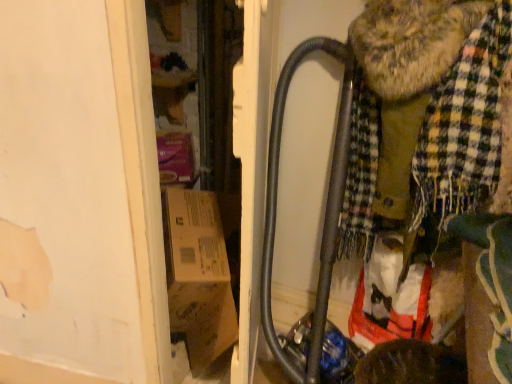
Identify the location of metallic gray baby carriage at center-right. (416, 147).

What do you see at coordinates (416, 147) in the screenshot?
I see `metallic gray baby carriage at center-right` at bounding box center [416, 147].

Based on the photo, what is the approximate height of metallic gray baby carriage at center-right?

metallic gray baby carriage at center-right is 29.77 inches tall.

This screenshot has height=384, width=512. What are the coordinates of `plaid fabric scarf at right` in the screenshot? It's located at (428, 118).

What do you see at coordinates (428, 118) in the screenshot? Image resolution: width=512 pixels, height=384 pixels. I see `plaid fabric scarf at right` at bounding box center [428, 118].

This screenshot has height=384, width=512. I want to click on metallic gray baby carriage at center-right, so click(416, 147).

Which is more to the left, metallic gray baby carriage at center-right or plaid fabric scarf at right?

Positioned to the left is plaid fabric scarf at right.

Is metallic gray baby carriage at center-right positioned in front of plaid fabric scarf at right?

That is False.

Does point (388, 78) come farther from viewer compared to point (352, 164)?

No.

Consider the image. From the image's perspective, between metallic gray baby carriage at center-right and plaid fabric scarf at right, who is located below?

plaid fabric scarf at right, from the image's perspective.

From a real-world perspective, between metallic gray baby carriage at center-right and plaid fabric scarf at right, who is vertically lower?

plaid fabric scarf at right, from a real-world perspective.

In terms of width, does metallic gray baby carriage at center-right look wider or thinner when compared to plaid fabric scarf at right?

In the image, metallic gray baby carriage at center-right appears to be wider than plaid fabric scarf at right.

Considering the relative sizes of metallic gray baby carriage at center-right and plaid fabric scarf at right in the image provided, is metallic gray baby carriage at center-right shorter than plaid fabric scarf at right?

Correct, metallic gray baby carriage at center-right is not as tall as plaid fabric scarf at right.

Is metallic gray baby carriage at center-right smaller than plaid fabric scarf at right?

Yes, metallic gray baby carriage at center-right is smaller than plaid fabric scarf at right.

Which is correct: metallic gray baby carriage at center-right is inside plaid fabric scarf at right, or outside of it?

metallic gray baby carriage at center-right can be found inside plaid fabric scarf at right.

Is metallic gray baby carriage at center-right next to plaid fabric scarf at right and touching it?

Yes, metallic gray baby carriage at center-right and plaid fabric scarf at right clearly make contact.

Is metallic gray baby carriage at center-right oriented towards plaid fabric scarf at right?

Yes, metallic gray baby carriage at center-right is turned towards plaid fabric scarf at right.

Consider the image. How many degrees apart are the facing directions of metallic gray baby carriage at center-right and plaid fabric scarf at right?

89.6 degrees separate the facing orientations of metallic gray baby carriage at center-right and plaid fabric scarf at right.

How distant is metallic gray baby carriage at center-right from plaid fabric scarf at right?

They are 2.00 inches apart.

Where is `scarf on the left of the metallic gray baby carriage at center-right`? The image size is (512, 384). scarf on the left of the metallic gray baby carriage at center-right is located at coordinates (428, 118).

Which object is positioned more to the left, plaid fabric scarf at right or metallic gray baby carriage at center-right?

plaid fabric scarf at right is more to the left.

Considering their positions, is plaid fabric scarf at right located in front of or behind metallic gray baby carriage at center-right?

plaid fabric scarf at right is in front of metallic gray baby carriage at center-right.

Considering the positions of points (499, 43) and (306, 369), is point (499, 43) closer to camera compared to point (306, 369)?

Yes, it is in front of point (306, 369).

From the image's perspective, is plaid fabric scarf at right positioned above or below metallic gray baby carriage at center-right?

Clearly, from the image's perspective, plaid fabric scarf at right is below metallic gray baby carriage at center-right.

From a real-world perspective, which is physically below, plaid fabric scarf at right or metallic gray baby carriage at center-right?

In real-world perspective, plaid fabric scarf at right is lower.

Can you confirm if plaid fabric scarf at right is thinner than metallic gray baby carriage at center-right?

Yes.

Can you confirm if plaid fabric scarf at right is shorter than metallic gray baby carriage at center-right?

In fact, plaid fabric scarf at right may be taller than metallic gray baby carriage at center-right.

Is plaid fabric scarf at right bigger or smaller than metallic gray baby carriage at center-right?

Considering their sizes, plaid fabric scarf at right takes up more space than metallic gray baby carriage at center-right.

Would you say plaid fabric scarf at right contains metallic gray baby carriage at center-right?

That's incorrect, metallic gray baby carriage at center-right is not inside plaid fabric scarf at right.

Is plaid fabric scarf at right directly adjacent to metallic gray baby carriage at center-right?

Yes, plaid fabric scarf at right is next to metallic gray baby carriage at center-right.

Is metallic gray baby carriage at center-right at the back of plaid fabric scarf at right?

No, metallic gray baby carriage at center-right is not at the back of plaid fabric scarf at right.

How far apart are plaid fabric scarf at right and metallic gray baby carriage at center-right?

plaid fabric scarf at right is 2.00 inches away from metallic gray baby carriage at center-right.

Locate an element on the screen. The image size is (512, 384). scarf in front of the metallic gray baby carriage at center-right is located at coordinates (428, 118).

Locate an element on the screen. This screenshot has height=384, width=512. scarf in front of the metallic gray baby carriage at center-right is located at coordinates (428, 118).

Find the location of a particular element. This screenshot has width=512, height=384. baby carriage to the right of plaid fabric scarf at right is located at coordinates (416, 147).